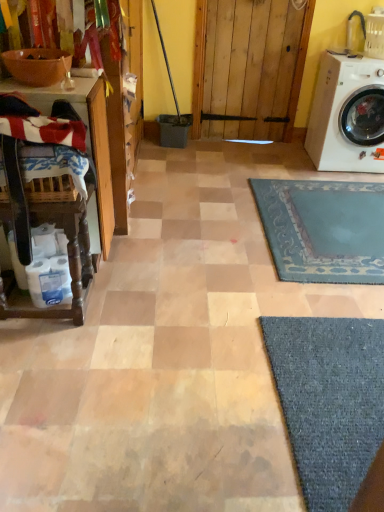
Question: In terms of size, does wooden table at left, marked as the 2th table in a top-to-bottom arrangement, appear bigger or smaller than wooden table at left, the first table viewed from the top?

Choices:
 (A) small
 (B) big

Answer: (A)

Question: Considering the positions of wooden table at left, the 1th table in the bottom-to-top sequence, and wooden table at left, the second table from the bottom, in the image, is wooden table at left, the 1th table in the bottom-to-top sequence, taller or shorter than wooden table at left, the second table from the bottom,?

Choices:
 (A) short
 (B) tall

Answer: (A)

Question: Which object is positioned closest to the wooden table at left, marked as the 2th table in a top-to-bottom arrangement?

Choices:
 (A) white plastic washing machine at right
 (B) matte brown bowl at upper left
 (C) striped cotton laundry at left
 (D) wooden table at left, the first table viewed from the top

Answer: (D)

Question: Estimate the real-world distances between objects in this image. Which object is farther from the wooden table at left, the 1th table in the bottom-to-top sequence?

Choices:
 (A) wooden table at left, the first table viewed from the top
 (B) matte brown bowl at upper left
 (C) striped cotton laundry at left
 (D) white plastic washing machine at right

Answer: (D)